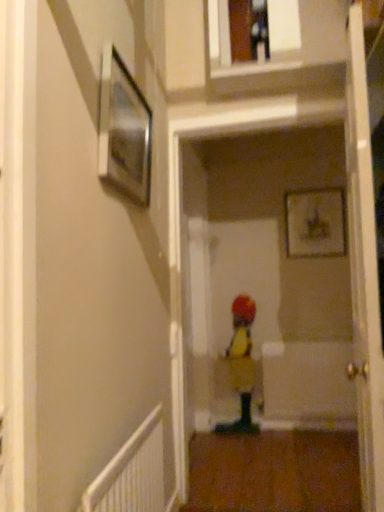
Question: Is yellow fabric toddler at center facing towards white textured radiator at lower left?

Choices:
 (A) yes
 (B) no

Answer: (A)

Question: Is yellow fabric toddler at center far away from white textured radiator at lower left?

Choices:
 (A) yes
 (B) no

Answer: (A)

Question: Does yellow fabric toddler at center have a greater height compared to white textured radiator at lower left?

Choices:
 (A) no
 (B) yes

Answer: (B)

Question: From a real-world perspective, is yellow fabric toddler at center located beneath white textured radiator at lower left?

Choices:
 (A) yes
 (B) no

Answer: (B)

Question: Is yellow fabric toddler at center next to white textured radiator at lower left and touching it?

Choices:
 (A) yes
 (B) no

Answer: (B)

Question: From the image's perspective, is white textured radiator at lower left above or below yellow fabric toddler at center?

Choices:
 (A) above
 (B) below

Answer: (A)

Question: Visually, is white textured radiator at lower left positioned to the left or to the right of yellow fabric toddler at center?

Choices:
 (A) left
 (B) right

Answer: (A)

Question: Do you think white textured radiator at lower left is within yellow fabric toddler at center, or outside of it?

Choices:
 (A) outside
 (B) inside

Answer: (A)

Question: Does point (127, 465) appear closer or farther from the camera than point (249, 297)?

Choices:
 (A) farther
 (B) closer

Answer: (B)

Question: From a real-world perspective, relative to metallic silver picture frame at upper left, which is counted as the first picture frame, starting from the left, is white textured radiator at lower left vertically above or below?

Choices:
 (A) above
 (B) below

Answer: (B)

Question: In terms of height, does white textured radiator at lower left look taller or shorter compared to metallic silver picture frame at upper left, positioned as the first picture frame in front-to-back order?

Choices:
 (A) tall
 (B) short

Answer: (A)

Question: Looking at their shapes, would you say white textured radiator at lower left is wider or thinner than metallic silver picture frame at upper left, positioned as the first picture frame in front-to-back order?

Choices:
 (A) wide
 (B) thin

Answer: (A)

Question: Is white textured radiator at lower left in front of or behind metallic silver picture frame at upper left, positioned as the first picture frame in front-to-back order, in the image?

Choices:
 (A) behind
 (B) front

Answer: (B)

Question: Considering the positions of yellow fabric toddler at center and metallic silver picture frame at upper left, which is counted as the first picture frame, starting from the left, in the image, is yellow fabric toddler at center bigger or smaller than metallic silver picture frame at upper left, which is counted as the first picture frame, starting from the left,?

Choices:
 (A) small
 (B) big

Answer: (B)

Question: From the image's perspective, is yellow fabric toddler at center positioned above or below metallic silver picture frame at upper left, which appears as the second picture frame when viewed from the back?

Choices:
 (A) below
 (B) above

Answer: (A)